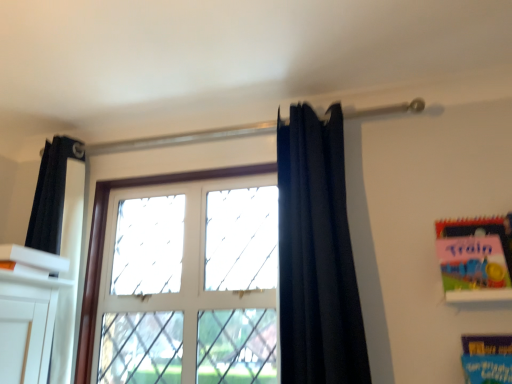
Question: In the image, is matte pink paper at upper right, positioned as the 1th paperback book in top-to-bottom order, positioned in front of or behind white glass window at center?

Choices:
 (A) front
 (B) behind

Answer: (A)

Question: Is point (480, 225) closer or farther from the camera than point (246, 170)?

Choices:
 (A) closer
 (B) farther

Answer: (A)

Question: Which object is positioned farthest from the matte pink paper at upper right, positioned as the 1th paperback book in top-to-bottom order?

Choices:
 (A) white glass window at center
 (B) dark blue fabric at center
 (C) blue cardboard book at lower right, marked as the first paperback book in a bottom-to-top arrangement

Answer: (A)

Question: Which object is the farthest from the white glass window at center?

Choices:
 (A) blue cardboard book at lower right, marked as the first paperback book in a bottom-to-top arrangement
 (B) matte pink paper at upper right, the 2th paperback book when ordered from bottom to top
 (C) dark blue fabric at center

Answer: (A)